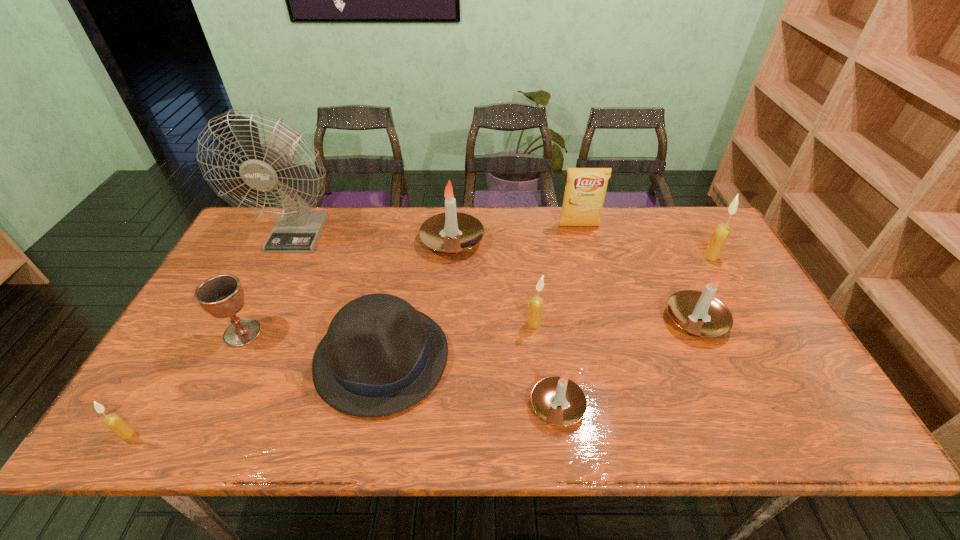
Identify the location of vacant area located on the front of the crisp (potato chip) with the logo. This screenshot has height=540, width=960. (600, 306).

Image resolution: width=960 pixels, height=540 pixels. In order to click on vacant space located 0.190m on the back of the second nearest cream candle in this screenshot , I will do `click(528, 270)`.

Find the location of a particular element. vacant area situated 0.330m on the left of the second object from right to left is located at coordinates (541, 320).

At what (x,y) coordinates should I click in order to perform the action: click on vacant region located 0.270m on the right of the chalice. Please return your answer as a coordinate pair (x, y). The height and width of the screenshot is (540, 960). Looking at the image, I should click on (365, 333).

Locate an element on the screen. This screenshot has width=960, height=540. vacant space situated on the left of the second white candle from right to left is located at coordinates (420, 406).

You are a GUI agent. You are given a task and a screenshot of the screen. Output one action in this format:
    pyautogui.click(x=<x>, y=<y>)
    Task: Click on the vacant space positioned on the back of the leftmost candle
    This screenshot has height=540, width=960.
    Given the screenshot: What is the action you would take?
    pyautogui.click(x=159, y=381)

Where is `fan at the far edge`? The width and height of the screenshot is (960, 540). fan at the far edge is located at coordinates (297, 230).

At what (x,y) coordinates should I click in order to perform the action: click on crisp (potato chip) present at the far edge. Please return your answer as a coordinate pair (x, y). Image resolution: width=960 pixels, height=540 pixels. Looking at the image, I should click on (585, 190).

The width and height of the screenshot is (960, 540). Find the location of `bowler hat that is at the near edge`. bowler hat that is at the near edge is located at coordinates (380, 356).

I want to click on fan at the left edge, so click(297, 230).